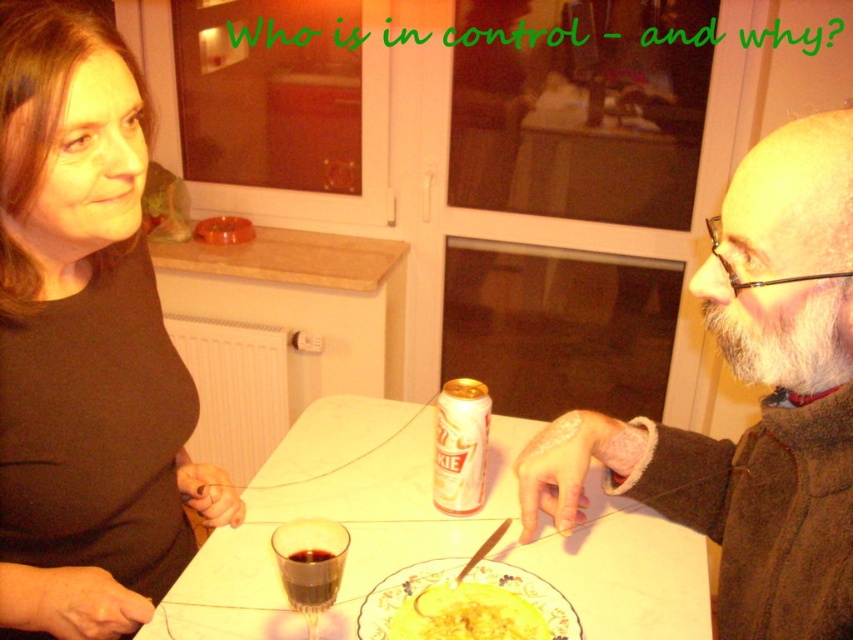
Question: Estimate the real-world distances between objects in this image. Which object is closer to the dark glassy wine at center?

Choices:
 (A) yellow matte plate at center
 (B) dark glass at center
 (C) brown matte shirt at upper left

Answer: (B)

Question: Observing the image, what is the correct spatial positioning of brown matte shirt at upper left in reference to yellow matte plate at center?

Choices:
 (A) above
 (B) below

Answer: (A)

Question: Among these objects, which one is nearest to the camera?

Choices:
 (A) brown matte shirt at upper left
 (B) gray wool sweater at right
 (C) yellow matte plate at center
 (D) dark glassy wine at center

Answer: (B)

Question: Where is gray wool sweater at right located in relation to dark glassy wine at center in the image?

Choices:
 (A) left
 (B) right

Answer: (B)

Question: Is gray wool sweater at right thinner than dark glassy wine at center?

Choices:
 (A) no
 (B) yes

Answer: (A)

Question: Which of the following is the closest to the observer?

Choices:
 (A) (395, 627)
 (B) (13, 321)
 (C) (288, 560)
 (D) (283, 579)

Answer: (C)